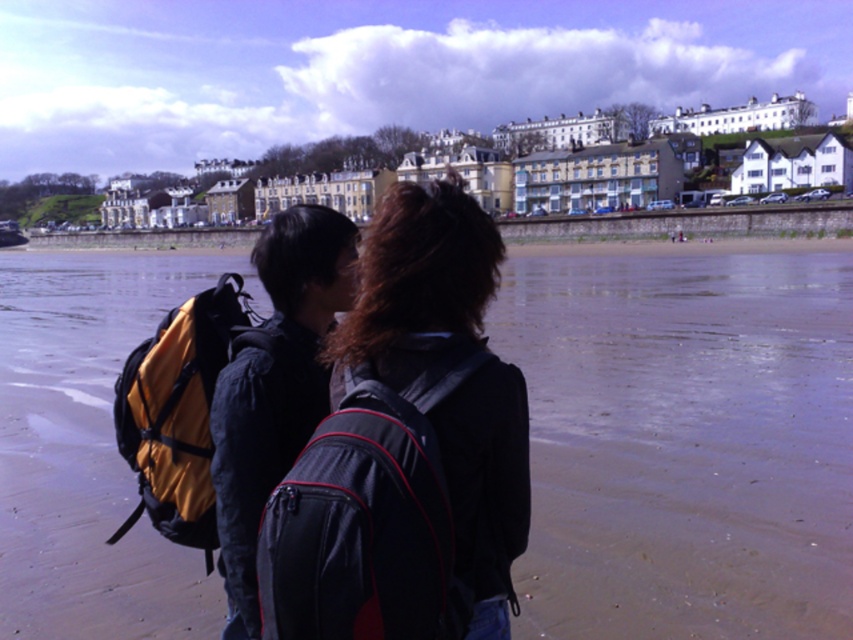
Is point (302, 572) closer to viewer compared to point (212, 291)?

Yes, point (302, 572) is in front of point (212, 291).

Who is more distant from viewer, (344, 554) or (180, 452)?

The point (180, 452) is more distant.

Between point (408, 593) and point (166, 404), which one is positioned behind?

The point (166, 404) is behind.

I want to click on black fabric backpack at center, so click(364, 524).

Which is behind, point (378, 356) or point (351, 436)?

The point (378, 356) is more distant.

Between matte black backpack at center and black fabric backpack at center, which one is positioned lower?

black fabric backpack at center is below.

This screenshot has height=640, width=853. I want to click on matte black backpack at center, so click(418, 289).

Does sandy beach at center have a lesser height compared to black fabric backpack at center?

Incorrect, sandy beach at center's height does not fall short of black fabric backpack at center's.

Between sandy beach at center and black fabric backpack at center, which one appears on the right side from the viewer's perspective?

sandy beach at center

Between point (804, 518) and point (368, 573), which one is positioned behind?

The point (804, 518) is behind.

Find the location of a particular element. sandy beach at center is located at coordinates (683, 440).